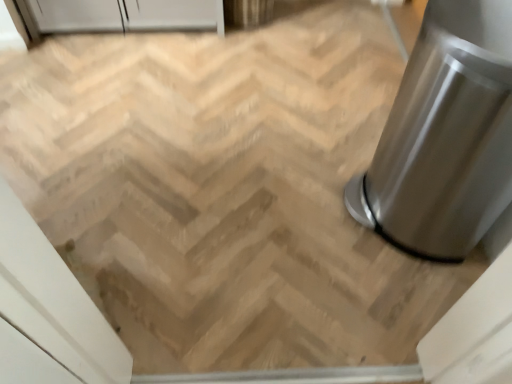
Identify the location of satin silver trash can at right. Image resolution: width=512 pixels, height=384 pixels. (446, 135).

Describe the element at coordinates (446, 135) in the screenshot. I see `satin silver trash can at right` at that location.

This screenshot has height=384, width=512. In order to click on satin silver trash can at right in this screenshot , I will do `click(446, 135)`.